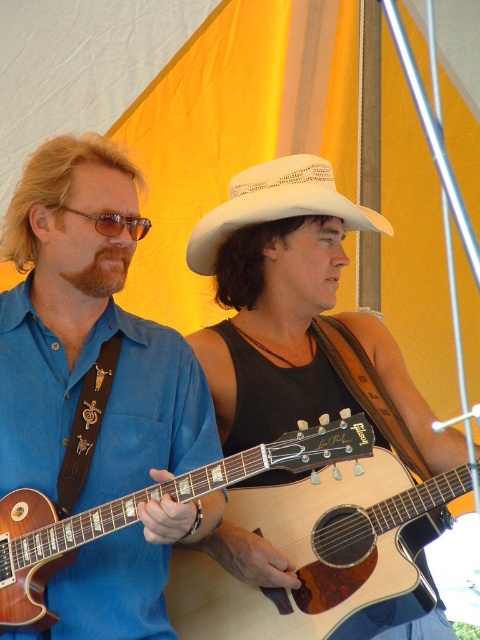
You are a photographer standing 3 feet away from the scene. You want to take a photo that includes both the white woven cowboy hat at center and the matte brown sunglasses at left. Based on the distance between them, will they both fit in your camera frame if your camera has a maximum horizontal field of view of 25 inches?

The distance between the white woven cowboy hat at center and matte brown sunglasses at left is 26.73 inches, which exceeds the camera frame of 25 inches. Therefore, they won not both fit in the frame.

You are a photographer setting up a shot of the performers. You need to position a light above the white woven cowboy hat at center so it doesn not cast a shadow on the matte brown sunglasses at left. Where should you place the light relative to the hat?

The white woven cowboy hat at center is located above matte brown sunglasses at left, so placing the light above the hat will ensure the shadow from the hat falls downward away from the sunglasses.

From the picture: You are a photographer setting up for a shoot and need to position a light to the left of the white woven cowboy hat at center. Will this light also be to the left of the matte brown guitar at center?

The matte brown guitar at center is to the right of the white woven cowboy hat at center, so placing the light to the left of the white woven cowboy hat at center would also place it to the left of the matte brown guitar at center.